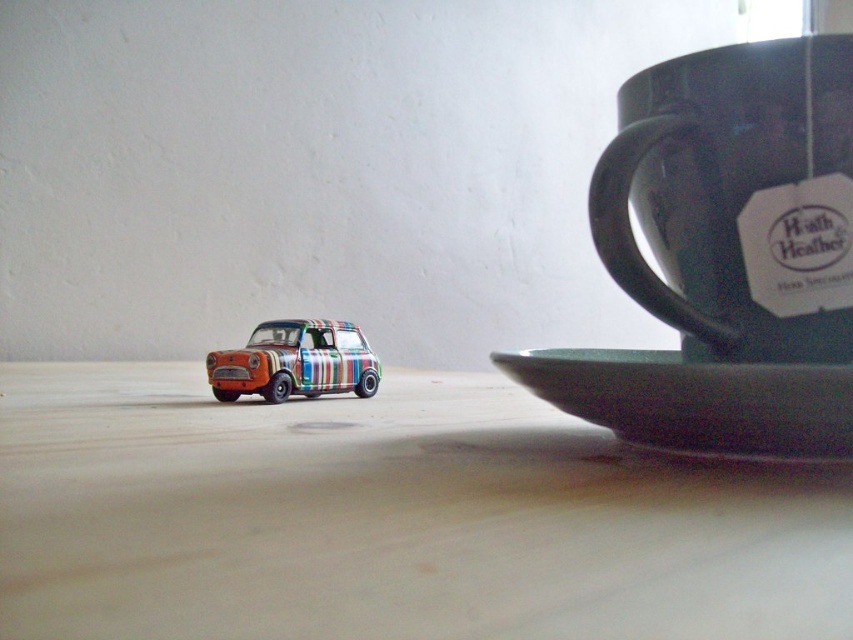
You are a photographer trying to capture a closeup of the miniature model car. You notice two points in the scene labeled as point 1 at coordinates (352,563) and point 2 at coordinates (305,358). Which point should you focus on to ensure the car is in sharp focus?

You should focus on point 1 at coordinates (352,563) because it is closer to the camera than point 2 at coordinates (305,358), ensuring the car remains in sharp focus.

You are looking at the image of the model car and the cup and saucer. There are two points marked in the image. Which point is closer to you, point (665, 380) or point (271, 353)?

Point (665, 380) is closer to the viewer than point (271, 353).